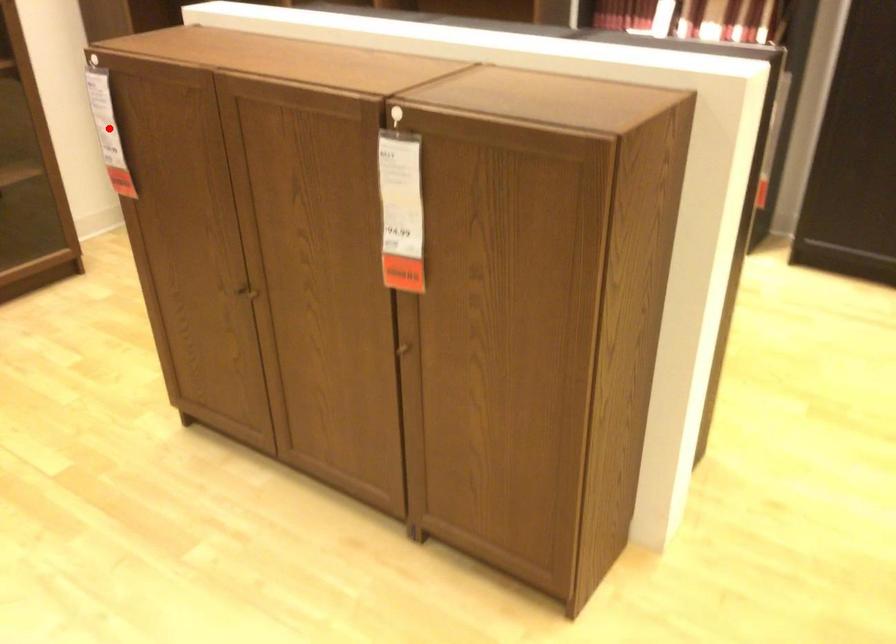
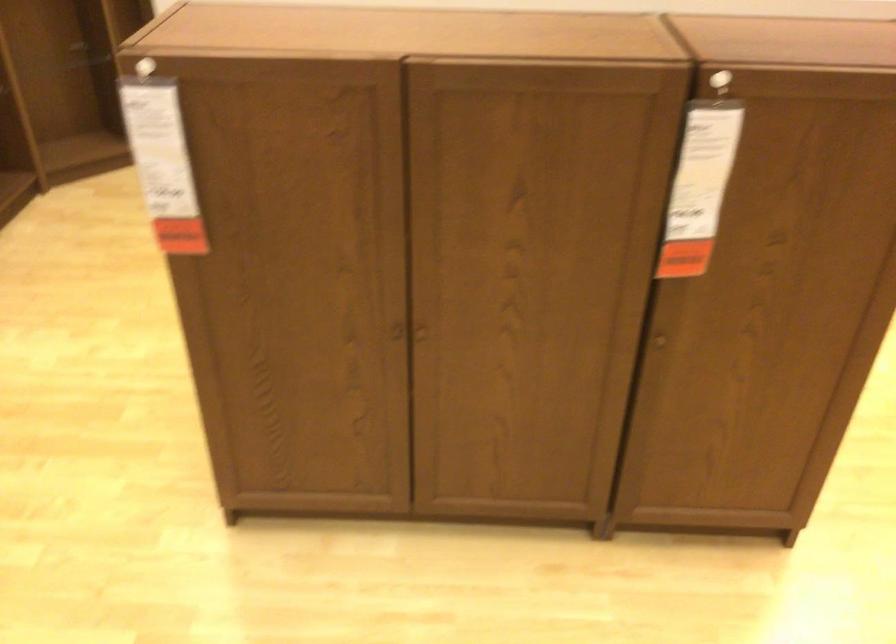
Question: I am providing you with two images of the same scene from different viewpoints. Image1 has a red point marked. In image2, the corresponding 3D location appears at what relative position? Reply with the corresponding letter.

Choices:
 (A) Closer
 (B) Farther

Answer: (A)